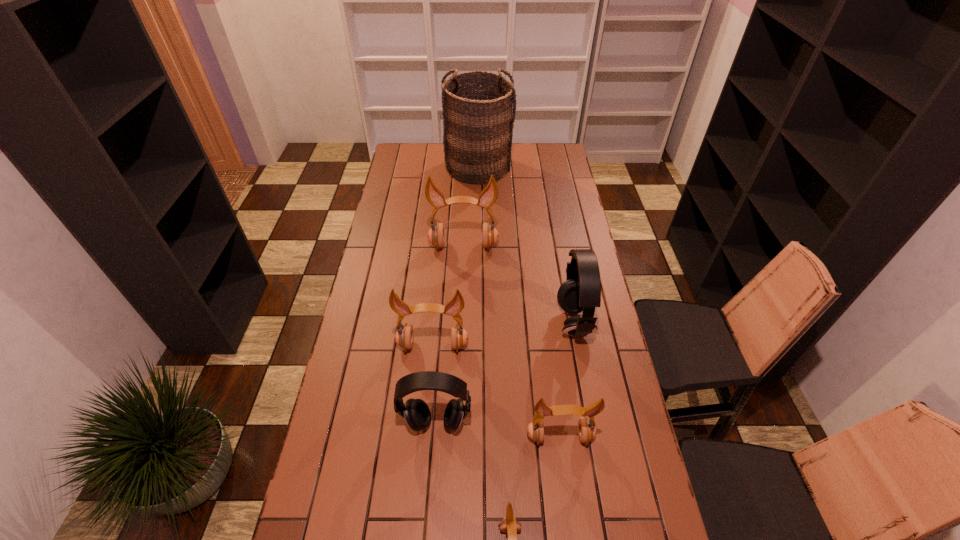
The image size is (960, 540). Find the location of `the nearer black earphone`. the nearer black earphone is located at coordinates (416, 412).

The height and width of the screenshot is (540, 960). In order to click on free region located on the right of the farthest object in this screenshot , I will do `click(540, 168)`.

This screenshot has width=960, height=540. Find the location of `free space located on the front-facing side of the second tallest object`. free space located on the front-facing side of the second tallest object is located at coordinates (461, 306).

Find the location of a particular element. This screenshot has width=960, height=540. blank space located 0.280m on the front-facing side of the third nearest brown earphone is located at coordinates (424, 440).

I want to click on free space located 0.130m on the ear cups of the bigger black earphone, so click(520, 322).

Identify the location of free space located 0.330m on the ear cups of the bigger black earphone. The width and height of the screenshot is (960, 540). (465, 322).

This screenshot has height=540, width=960. I want to click on vacant region located on the ear cups of the bigger black earphone, so click(535, 322).

Where is `vacant space located on the front-facing side of the rightmost brown earphone`? The height and width of the screenshot is (540, 960). vacant space located on the front-facing side of the rightmost brown earphone is located at coordinates (571, 528).

Locate an element on the screen. The width and height of the screenshot is (960, 540). vacant space located on the ear cups of the smaller black earphone is located at coordinates (433, 459).

Identify the location of object that is at the far edge. The height and width of the screenshot is (540, 960). (479, 107).